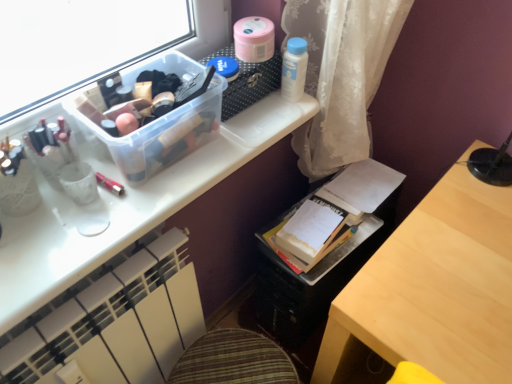
Where is `empty space that is to the right of metallic pink pen at upper left, the first toiletry positioned from the bottom`? This screenshot has width=512, height=384. empty space that is to the right of metallic pink pen at upper left, the first toiletry positioned from the bottom is located at coordinates (177, 170).